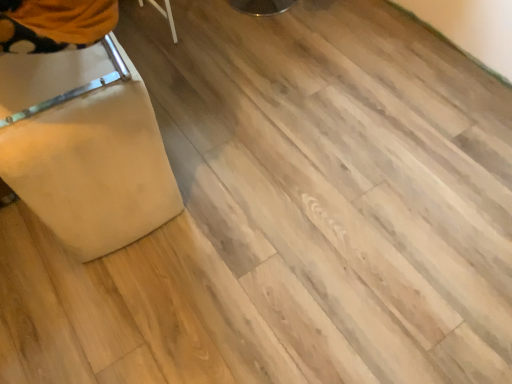
Find the location of a particular element. beige fabric ottoman at lower left is located at coordinates (85, 148).

What is the approximate height of beige fabric ottoman at lower left?

beige fabric ottoman at lower left is 28.31 inches in height.

What do you see at coordinates (85, 148) in the screenshot?
I see `beige fabric ottoman at lower left` at bounding box center [85, 148].

In order to click on beige fabric ottoman at lower left in this screenshot , I will do `click(85, 148)`.